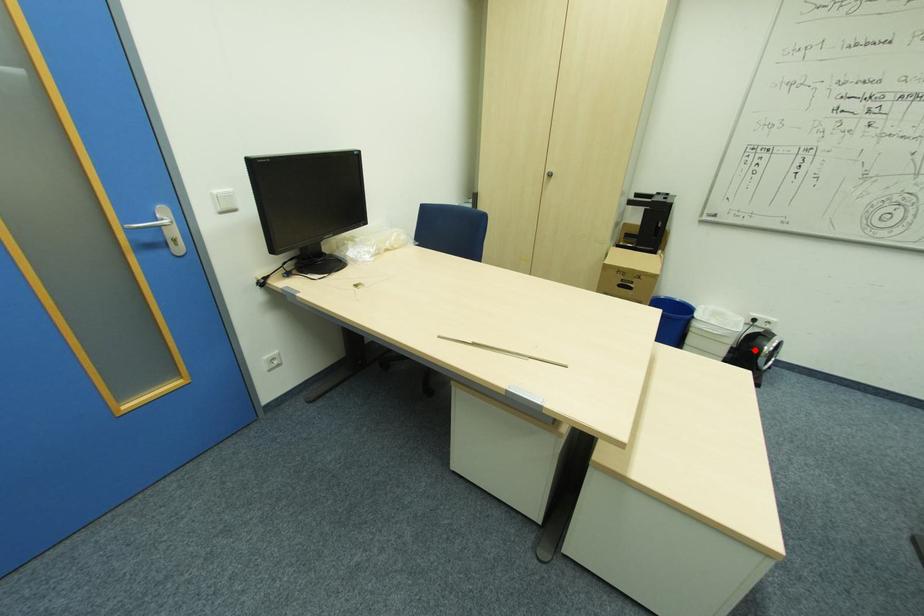
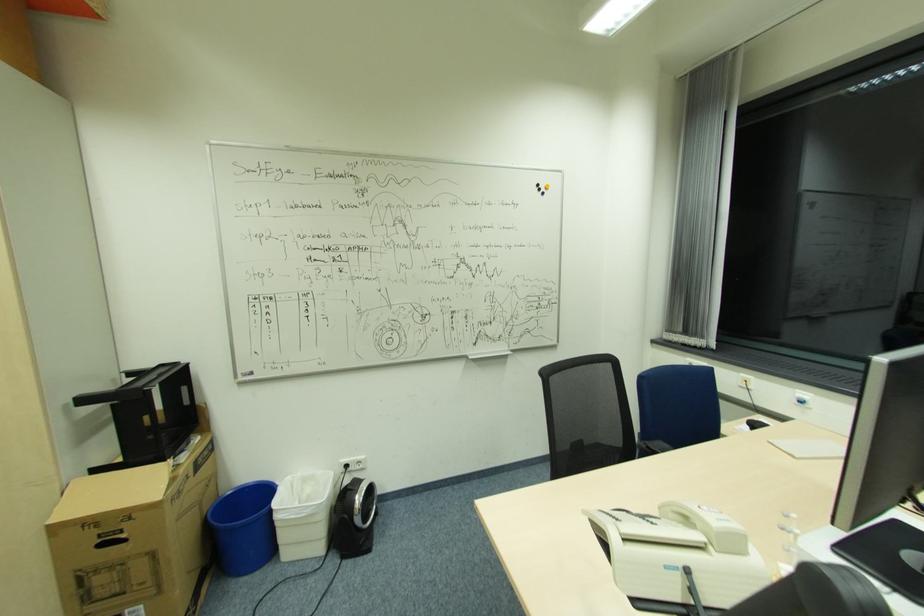
Locate, in the second image, the point that corresponds to the highlighted location in the first image.

(347, 515)